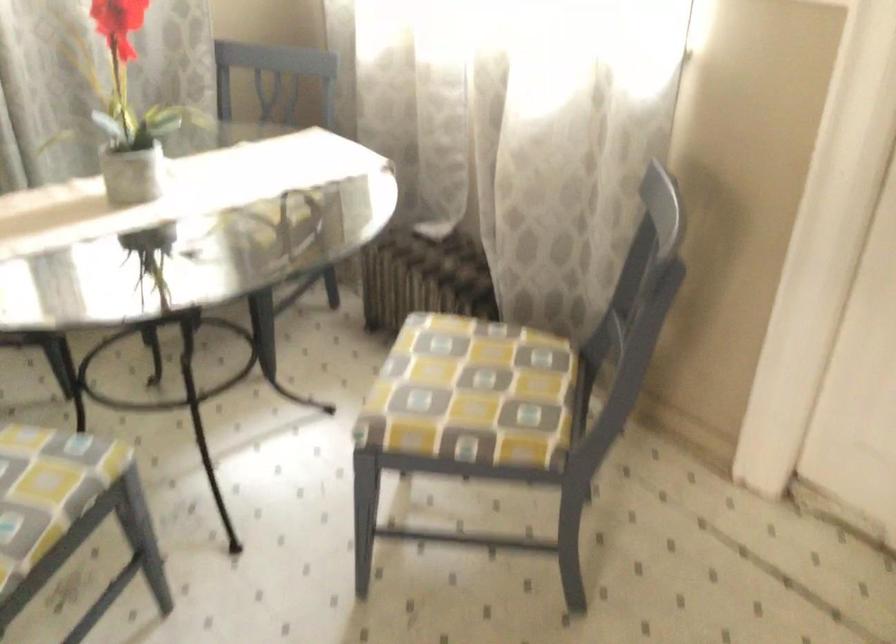
This screenshot has width=896, height=644. What do you see at coordinates (133, 175) in the screenshot? I see `a grey flower pot` at bounding box center [133, 175].